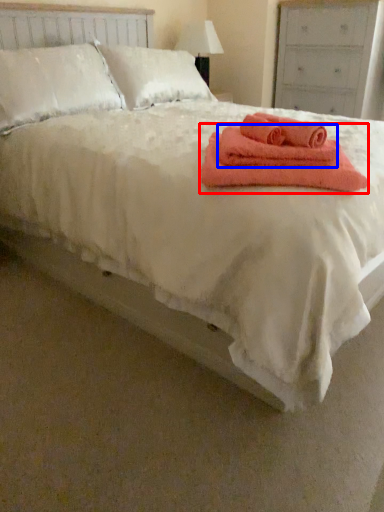
Question: Which object is closer to the camera taking this photo, towel (highlighted by a red box) or bath towel (highlighted by a blue box)?

Choices:
 (A) towel
 (B) bath towel

Answer: (A)